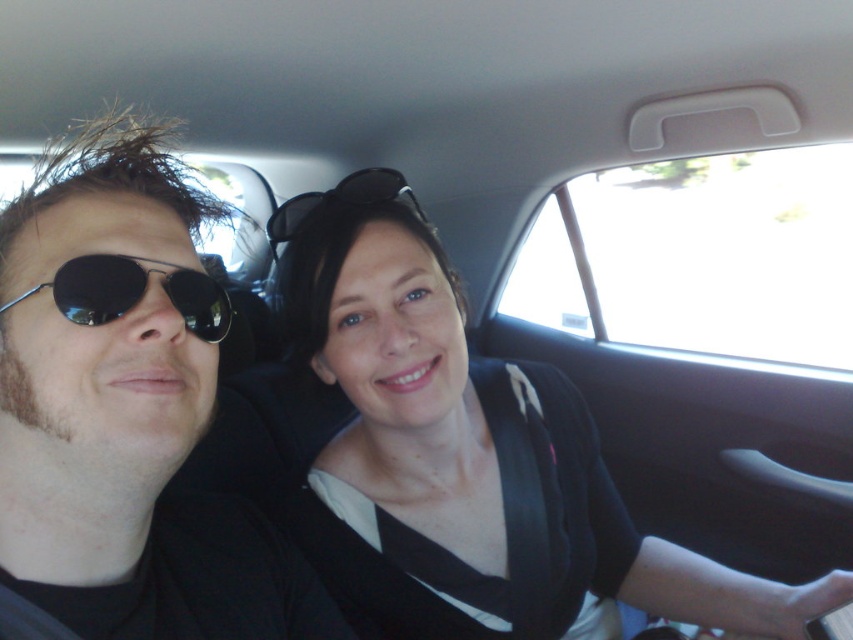
In the scene shown: Does matte black sunglasses at left have a greater width compared to black reflective sunglasses at left?

Yes, matte black sunglasses at left is wider than black reflective sunglasses at left.

Does matte black sunglasses at left come in front of black reflective sunglasses at left?

Yes, matte black sunglasses at left is in front of black reflective sunglasses at left.

Between point (1, 380) and point (229, 305), which one is positioned behind?

Point (229, 305)

Identify the location of matte black sunglasses at left. (125, 410).

Is the position of matte black sunglasses at left more distant than that of matte black sunglasses at center?

That is False.

Does matte black sunglasses at left have a smaller size compared to matte black sunglasses at center?

Incorrect, matte black sunglasses at left is not smaller in size than matte black sunglasses at center.

Where is `matte black sunglasses at left`? The height and width of the screenshot is (640, 853). matte black sunglasses at left is located at coordinates (125, 410).

Can you confirm if black reflective sunglasses at left is thinner than matte black sunglasses at center?

Correct, black reflective sunglasses at left's width is less than matte black sunglasses at center's.

Is point (195, 298) farther from camera compared to point (368, 173)?

That is False.

The height and width of the screenshot is (640, 853). I want to click on black reflective sunglasses at left, so click(134, 292).

This screenshot has height=640, width=853. What are the coordinates of `black reflective sunglasses at left` in the screenshot? It's located at (134, 292).